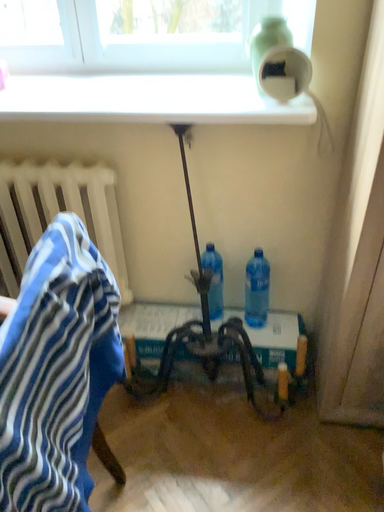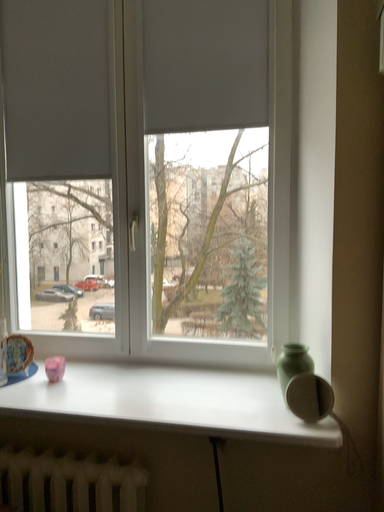
Question: Which way did the camera rotate in the video?

Choices:
 (A) rotated upward
 (B) rotated downward

Answer: (A)